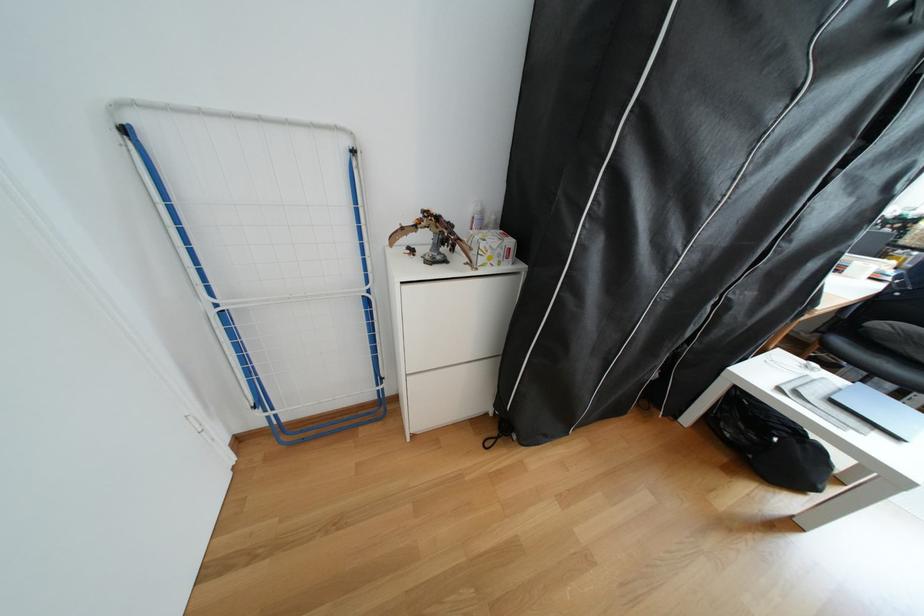
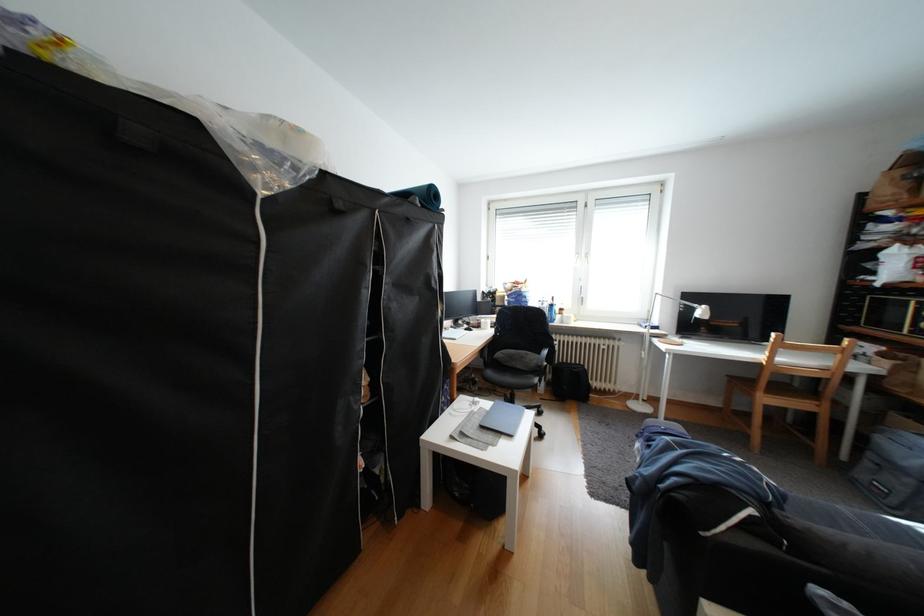
Question: The camera is either moving clockwise (left) or counter-clockwise (right) around the object. The first image is from the beginning of the video and the second image is from the end. Is the camera moving left or right when shooting the video?

Choices:
 (A) Left
 (B) Right

Answer: (A)